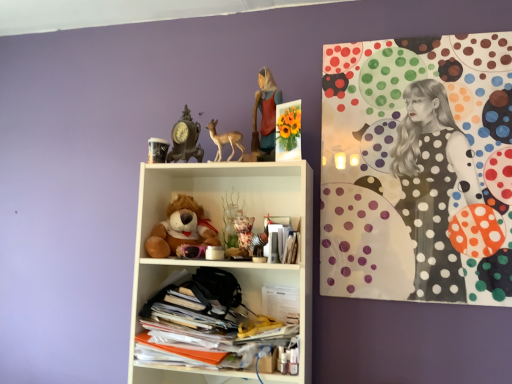
Question: Can you confirm if polka dot fabric at upper right is bigger than white plastic shelf at center, positioned as the second shelf in bottom-to-top order?

Choices:
 (A) yes
 (B) no

Answer: (B)

Question: Is the position of polka dot fabric at upper right more distant than that of white plastic shelf at center, which is the 1th shelf from top to bottom?

Choices:
 (A) no
 (B) yes

Answer: (B)

Question: Is polka dot fabric at upper right at the right side of white plastic shelf at center, which is the 1th shelf from top to bottom?

Choices:
 (A) yes
 (B) no

Answer: (A)

Question: From a real-world perspective, does polka dot fabric at upper right stand above white plastic shelf at center, positioned as the second shelf in bottom-to-top order?

Choices:
 (A) no
 (B) yes

Answer: (B)

Question: Considering the relative sizes of polka dot fabric at upper right and white plastic shelf at center, positioned as the second shelf in bottom-to-top order, in the image provided, is polka dot fabric at upper right shorter than white plastic shelf at center, positioned as the second shelf in bottom-to-top order,?

Choices:
 (A) yes
 (B) no

Answer: (B)

Question: Is white plastic shelf at center, positioned as the second shelf in bottom-to-top order, located within polka dot fabric at upper right?

Choices:
 (A) no
 (B) yes

Answer: (A)

Question: Can you confirm if soft brown plush at center is shorter than matte red dress at upper center?

Choices:
 (A) no
 (B) yes

Answer: (B)

Question: Is soft brown plush at center positioned behind matte red dress at upper center?

Choices:
 (A) no
 (B) yes

Answer: (A)

Question: Is soft brown plush at center closer to the viewer compared to matte red dress at upper center?

Choices:
 (A) yes
 (B) no

Answer: (A)

Question: Is soft brown plush at center beside matte red dress at upper center?

Choices:
 (A) yes
 (B) no

Answer: (B)

Question: From a real-world perspective, is soft brown plush at center located beneath matte red dress at upper center?

Choices:
 (A) yes
 (B) no

Answer: (A)

Question: Considering the relative sizes of soft brown plush at center and matte red dress at upper center in the image provided, is soft brown plush at center bigger than matte red dress at upper center?

Choices:
 (A) yes
 (B) no

Answer: (A)

Question: Does antique clock at upper center have a greater width compared to stacked papers at lower center, marked as the second shelf in a top-to-bottom arrangement?

Choices:
 (A) yes
 (B) no

Answer: (B)